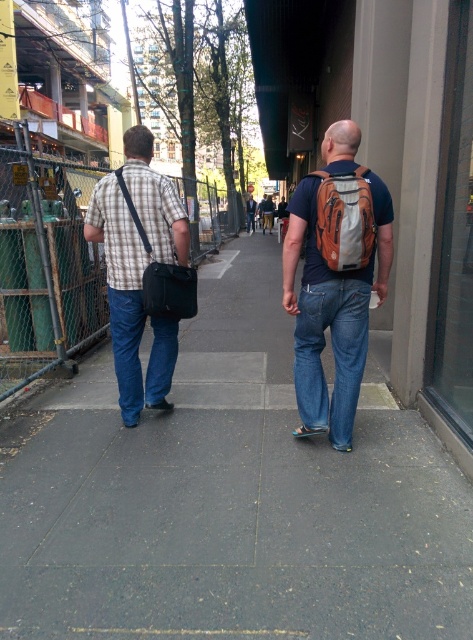
Is matte orange backpack at center smaller than plaid fabric shirt at left?

Correct, matte orange backpack at center occupies less space than plaid fabric shirt at left.

Does point (349, 148) come in front of point (129, 301)?

Yes, it is in front of point (129, 301).

The height and width of the screenshot is (640, 473). What are the coordinates of `matte orange backpack at center` in the screenshot? It's located at (334, 280).

Can you confirm if plaid fabric shirt at left is positioned to the right of blue denim jeans at left?

In fact, plaid fabric shirt at left is to the left of blue denim jeans at left.

Who is lower down, plaid fabric shirt at left or blue denim jeans at left?

Positioned lower is blue denim jeans at left.

You are a GUI agent. You are given a task and a screenshot of the screen. Output one action in this format:
    pyautogui.click(x=<x>, y=<y>)
    Task: Click on the plaid fabric shirt at left
    This screenshot has width=473, height=640.
    Given the screenshot: What is the action you would take?
    pyautogui.click(x=138, y=269)

From the picture: Does blue denim jeans at center have a smaller size compared to orange fabric backpack at center?

Actually, blue denim jeans at center might be larger than orange fabric backpack at center.

Measure the distance from blue denim jeans at center to orange fabric backpack at center.

A distance of 22.80 inches exists between blue denim jeans at center and orange fabric backpack at center.

You are a GUI agent. You are given a task and a screenshot of the screen. Output one action in this format:
    pyautogui.click(x=<x>, y=<y>)
    Task: Click on the blue denim jeans at center
    This screenshot has height=640, width=473.
    Given the screenshot: What is the action you would take?
    pyautogui.click(x=333, y=355)